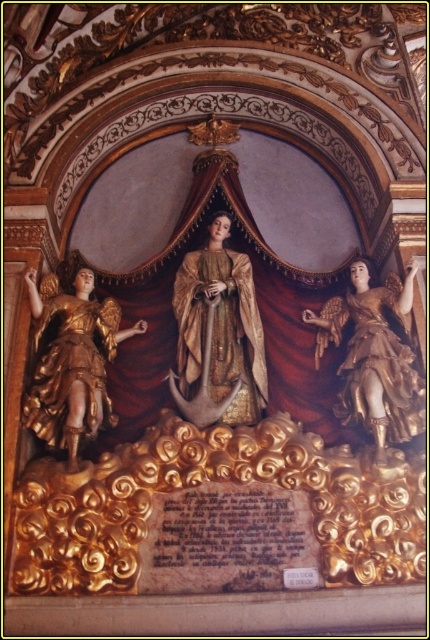
Question: Which object is positioned closest to the gold textured fabric at center?

Choices:
 (A) gold/gilded statue at right
 (B) gold polished statue at left

Answer: (B)

Question: Does gold polished statue at left appear under gold/gilded statue at right?

Choices:
 (A) no
 (B) yes

Answer: (B)

Question: Is gold textured fabric at center above gold/gilded statue at right?

Choices:
 (A) no
 (B) yes

Answer: (B)

Question: Considering the real-world distances, which object is closest to the gold textured fabric at center?

Choices:
 (A) gold polished statue at left
 (B) gold/gilded statue at right

Answer: (A)

Question: Estimate the real-world distances between objects in this image. Which object is closer to the gold textured fabric at center?

Choices:
 (A) gold polished statue at left
 (B) gold/gilded statue at right

Answer: (A)

Question: Can you confirm if gold textured fabric at center is thinner than gold/gilded statue at right?

Choices:
 (A) no
 (B) yes

Answer: (B)